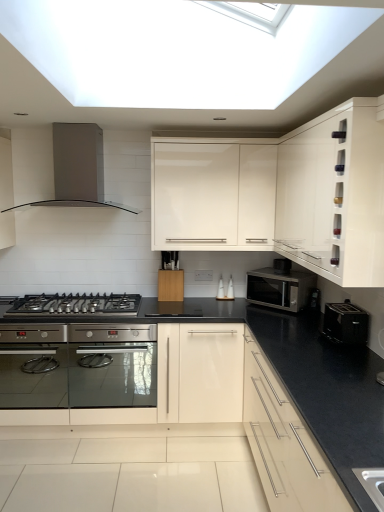
At what (x,y) coordinates should I click in order to perform the action: click on free space above black plastic toaster at right, which ranks as the 2th appliance in back-to-front order (from a real-world perspective). Please return your answer as a coordinate pair (x, y). Looking at the image, I should click on (355, 305).